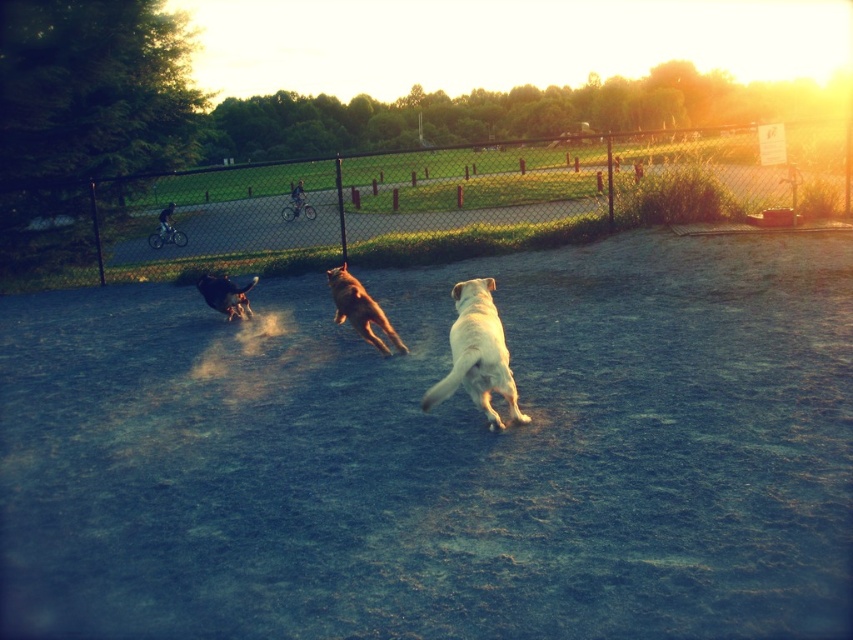
Question: Considering the relative positions of light yellow fur at center and golden fur dog at center in the image provided, where is light yellow fur at center located with respect to golden fur dog at center?

Choices:
 (A) left
 (B) right

Answer: (B)

Question: Which object appears closest to the camera in this image?

Choices:
 (A) golden fur dog at center
 (B) black fur dog at left

Answer: (A)

Question: Does light yellow fur at center come in front of black fur dog at left?

Choices:
 (A) no
 (B) yes

Answer: (B)

Question: Among these points, which one is nearest to the camera?

Choices:
 (A) (354, 276)
 (B) (109, 212)

Answer: (A)

Question: Which object is the farthest from the light yellow fur at center?

Choices:
 (A) black chain-link fence at upper center
 (B) black fur dog at left

Answer: (A)

Question: Is black chain-link fence at upper center wider than golden fur dog at center?

Choices:
 (A) no
 (B) yes

Answer: (B)